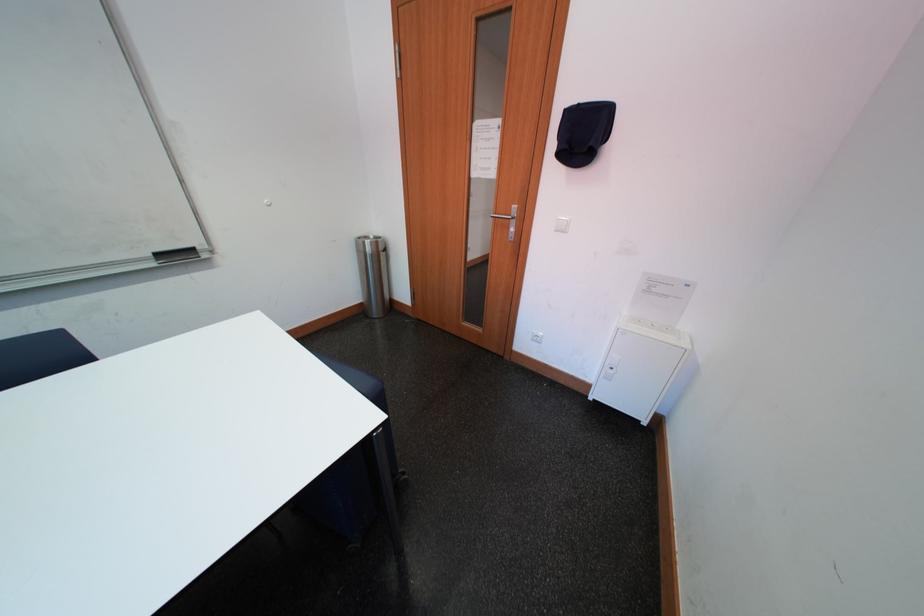
At what (x,y) coordinates should I click in order to perform the action: click on white cabinet lock. Please return your answer as a coordinate pair (x, y). The height and width of the screenshot is (616, 924). Looking at the image, I should click on (611, 365).